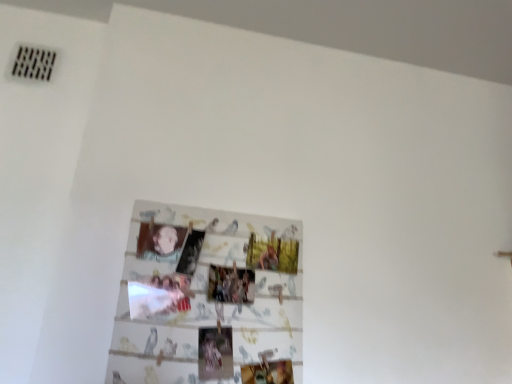
Question: Should I look upward or downward to see smooth beige baby at center?

Choices:
 (A) down
 (B) up

Answer: (A)

Question: Is the position of wooden photo collage at center more distant than that of smooth beige baby at center?

Choices:
 (A) yes
 (B) no

Answer: (B)

Question: Can you confirm if wooden photo collage at center is shorter than smooth beige baby at center?

Choices:
 (A) yes
 (B) no

Answer: (B)

Question: Is wooden photo collage at center beside smooth beige baby at center?

Choices:
 (A) no
 (B) yes

Answer: (A)

Question: From the image's perspective, does wooden photo collage at center appear higher than smooth beige baby at center?

Choices:
 (A) no
 (B) yes

Answer: (A)

Question: From the image's perspective, is wooden photo collage at center below smooth beige baby at center?

Choices:
 (A) no
 (B) yes

Answer: (B)

Question: From a real-world perspective, is wooden photo collage at center under smooth beige baby at center?

Choices:
 (A) no
 (B) yes

Answer: (B)

Question: Can you confirm if smooth beige baby at center is wider than wooden photo collage at center?

Choices:
 (A) no
 (B) yes

Answer: (A)

Question: Considering the relative sizes of smooth beige baby at center and wooden photo collage at center in the image provided, is smooth beige baby at center taller than wooden photo collage at center?

Choices:
 (A) no
 (B) yes

Answer: (A)

Question: Is smooth beige baby at center not near wooden photo collage at center?

Choices:
 (A) yes
 (B) no

Answer: (B)

Question: Is smooth beige baby at center at the left side of wooden photo collage at center?

Choices:
 (A) yes
 (B) no

Answer: (A)

Question: Can you confirm if smooth beige baby at center is bigger than wooden photo collage at center?

Choices:
 (A) no
 (B) yes

Answer: (A)

Question: Does smooth beige baby at center lie behind wooden photo collage at center?

Choices:
 (A) no
 (B) yes

Answer: (B)

Question: Is smooth beige baby at center in front of or behind wooden photo collage at center in the image?

Choices:
 (A) behind
 (B) front

Answer: (A)